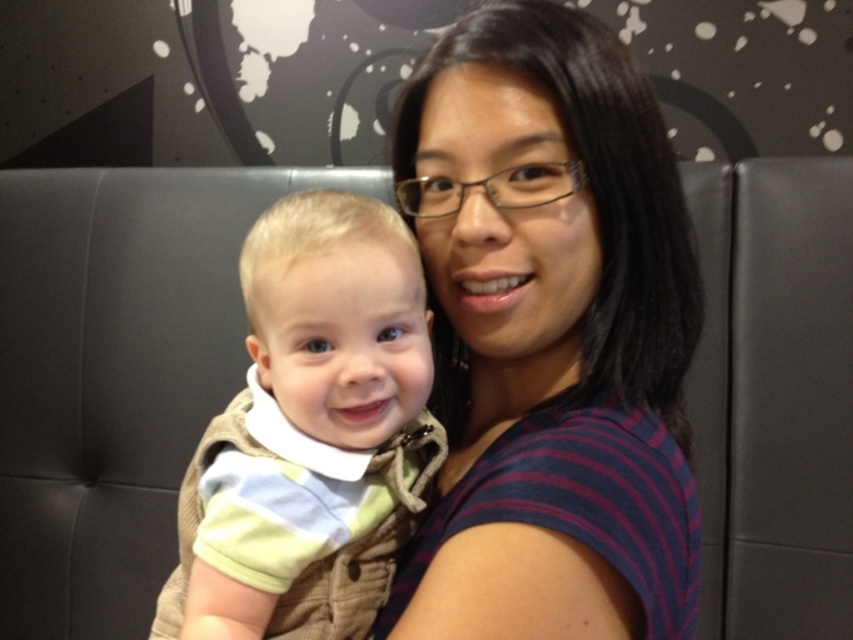
Question: Among these points, which one is farthest from the camera?

Choices:
 (A) click(183, 518)
 (B) click(492, 257)

Answer: (A)

Question: Is striped fabric shirt at center in front of striped fabric baby at left?

Choices:
 (A) no
 (B) yes

Answer: (B)

Question: Is striped fabric shirt at center positioned at the back of striped fabric baby at left?

Choices:
 (A) no
 (B) yes

Answer: (A)

Question: Which object appears farthest from the camera in this image?

Choices:
 (A) striped fabric baby at left
 (B) striped fabric shirt at center

Answer: (A)

Question: Is striped fabric shirt at center further to the viewer compared to striped fabric baby at left?

Choices:
 (A) no
 (B) yes

Answer: (A)

Question: Which object is closer to the camera taking this photo?

Choices:
 (A) striped fabric baby at left
 (B) striped fabric shirt at center

Answer: (B)